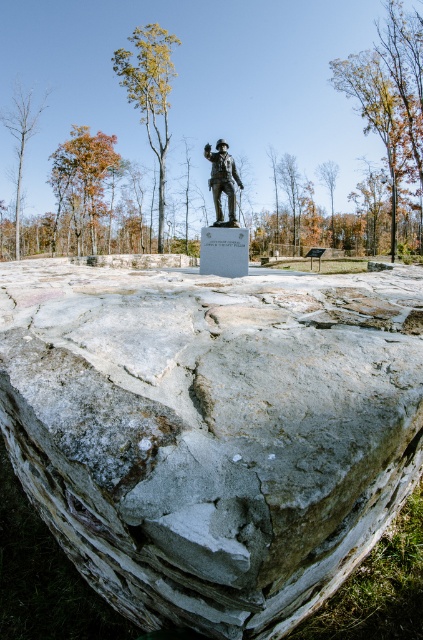
Question: Which of the following is the closest to the observer?

Choices:
 (A) (140, 51)
 (B) (16, 193)
 (C) (220, 172)

Answer: (C)

Question: From the image, what is the correct spatial relationship of bare wood tree at left in relation to bronze statue at center?

Choices:
 (A) below
 (B) above

Answer: (B)

Question: Can you confirm if green leafy tree at upper left is wider than brown wood tree at center?

Choices:
 (A) yes
 (B) no

Answer: (A)

Question: Does brown leafy tree at upper right have a smaller size compared to bronze statue at center?

Choices:
 (A) yes
 (B) no

Answer: (B)

Question: Which of the following is the farthest from the observer?

Choices:
 (A) (326, 173)
 (B) (36, 352)

Answer: (A)

Question: Among these points, which one is farthest from the camera?

Choices:
 (A) (293, 358)
 (B) (32, 104)
 (C) (269, 204)
 (D) (57, 184)

Answer: (C)